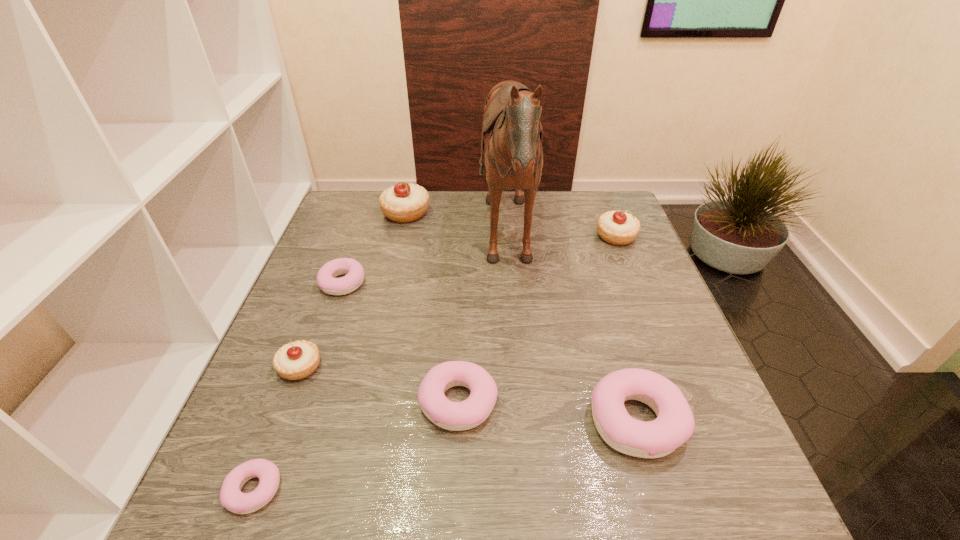
This screenshot has height=540, width=960. What are the coordinates of `vacant area that lies between the biggest pink pastry and the shortest object` in the screenshot? It's located at (445, 455).

This screenshot has width=960, height=540. Identify the location of free space between the rightmost beige pastry and the saddle. (563, 240).

Find the location of a particular element. The image size is (960, 540). free space between the smallest pink pastry and the saddle is located at coordinates point(381,367).

Find the location of a particular element. The height and width of the screenshot is (540, 960). unoccupied area between the rightmost pink pastry and the farthest pink pastry is located at coordinates (490, 352).

Find the location of a particular element. This screenshot has height=540, width=960. empty space that is in between the biggest beige pastry and the third shortest pastry is located at coordinates (432, 308).

Identify the location of object that is the sixth closest to the biggest pink pastry. This screenshot has height=540, width=960. (354, 273).

Identify which object is the closest to the leftmost beige pastry. Please provide its 2D coordinates. Your answer should be formatted as a tuple, i.e. [(x, y)], where the tuple contains the x and y coordinates of a point satisfying the conditions above.

[(354, 273)]

Locate which pastry ranks in proximity to the rightmost pink pastry. Please provide its 2D coordinates. Your answer should be formatted as a tuple, i.e. [(x, y)], where the tuple contains the x and y coordinates of a point satisfying the conditions above.

[(456, 416)]

Select which pastry is the closest to the third tallest object. Please provide its 2D coordinates. Your answer should be formatted as a tuple, i.e. [(x, y)], where the tuple contains the x and y coordinates of a point satisfying the conditions above.

[(674, 425)]

The image size is (960, 540). I want to click on beige pastry that is the second closest to the biggest pink pastry, so click(297, 360).